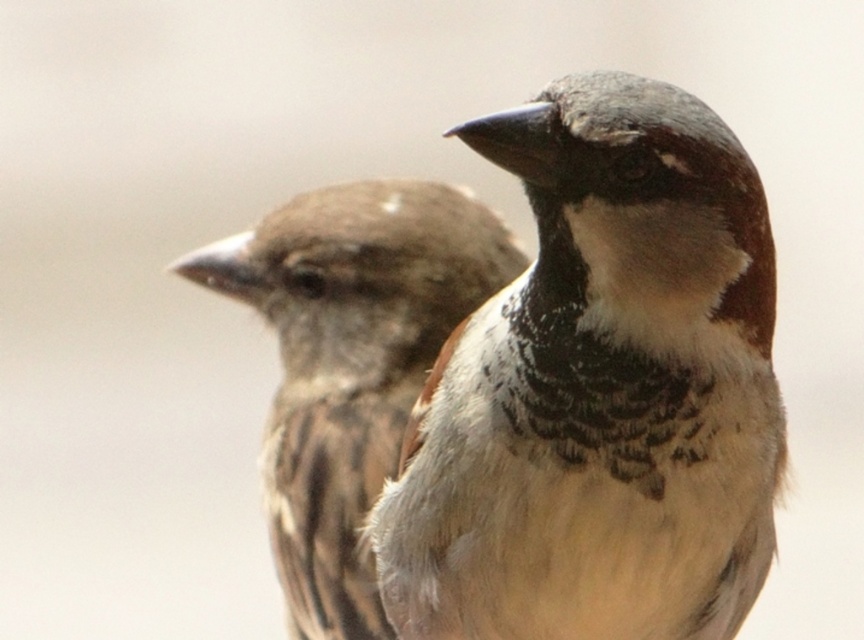
You are a photographer who wants to adjust the focus of your camera to capture the brown speckled feathers at center. What coordinates should you aim for to ensure the feathers are in focus?

The brown speckled feathers at center are located at coordinates point (600, 392), so you should aim your camera focus at that point to ensure they are in focus.

You are a photographer trying to capture both the brown speckled feathers at center and the brown feathered sparrow at left in focus. Based on the scene, which object would appear more blurred in the final photo?

The brown speckled feathers at center would appear more blurred because it is thinner than the brown feathered sparrow at left, making it harder to maintain focus on the thinner object in a close proximity shot.

You are a photographer trying to capture a clear image of the brown speckled feathers at center and the brown feathered sparrow at left. Based on the scene, which one is more likely to be in focus?

The brown speckled feathers at center is in front of the brown feathered sparrow at left, so it is more likely to be in focus.